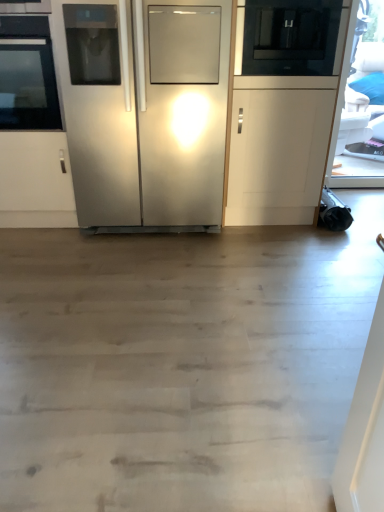
Question: Is black glass oven at left a part of black glass microwave at upper right?

Choices:
 (A) no
 (B) yes

Answer: (A)

Question: Considering the relative positions of black glass microwave at upper right and black glass oven at left in the image provided, is black glass microwave at upper right to the right of black glass oven at left from the viewer's perspective?

Choices:
 (A) no
 (B) yes

Answer: (B)

Question: Is black glass microwave at upper right thinner than black glass oven at left?

Choices:
 (A) no
 (B) yes

Answer: (A)

Question: Would you say black glass microwave at upper right is outside black glass oven at left?

Choices:
 (A) yes
 (B) no

Answer: (A)

Question: Could you tell me if black glass microwave at upper right is facing black glass oven at left?

Choices:
 (A) no
 (B) yes

Answer: (A)

Question: Is black glass microwave at upper right smaller than black glass oven at left?

Choices:
 (A) yes
 (B) no

Answer: (A)

Question: Is stainless steel refrigerator at center a part of black glass microwave at upper right?

Choices:
 (A) no
 (B) yes

Answer: (A)

Question: Is black glass microwave at upper right not inside stainless steel refrigerator at center?

Choices:
 (A) no
 (B) yes

Answer: (B)

Question: Is there a large distance between black glass microwave at upper right and stainless steel refrigerator at center?

Choices:
 (A) yes
 (B) no

Answer: (B)

Question: Is black glass microwave at upper right with stainless steel refrigerator at center?

Choices:
 (A) no
 (B) yes

Answer: (A)

Question: Is black glass microwave at upper right to the left of stainless steel refrigerator at center from the viewer's perspective?

Choices:
 (A) yes
 (B) no

Answer: (B)

Question: Is black glass microwave at upper right behind stainless steel refrigerator at center?

Choices:
 (A) yes
 (B) no

Answer: (A)

Question: From a real-world perspective, is stainless steel refrigerator at center physically below black glass microwave at upper right?

Choices:
 (A) yes
 (B) no

Answer: (A)